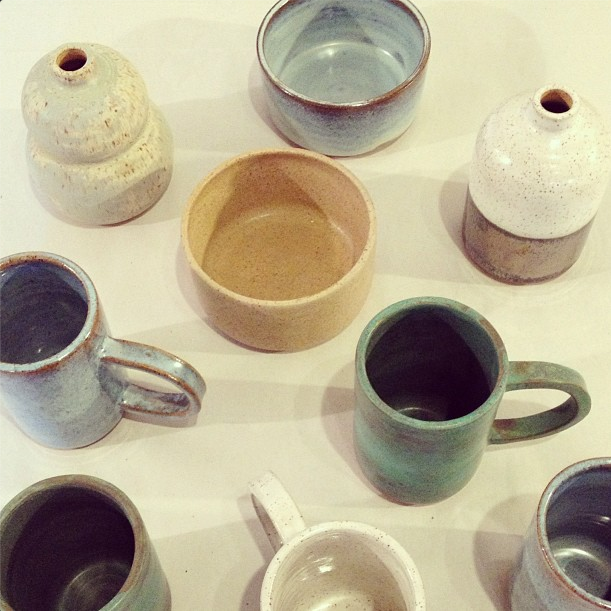
At what (x,y) coordinates should I click in order to perform the action: click on empty space between cups. Please return your answer as a coordinate pair (x, y). The image size is (611, 611). Looking at the image, I should click on (455, 569).